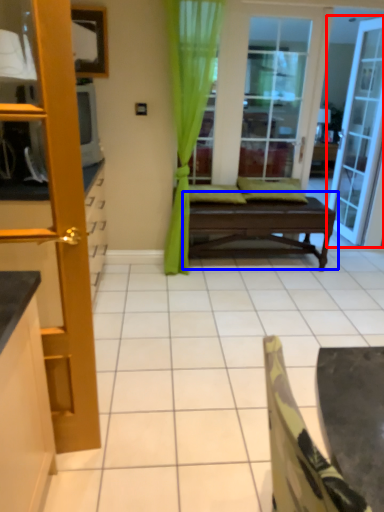
Question: Among these objects, which one is farthest to the camera, door (highlighted by a red box) or table (highlighted by a blue box)?

Choices:
 (A) door
 (B) table

Answer: (A)